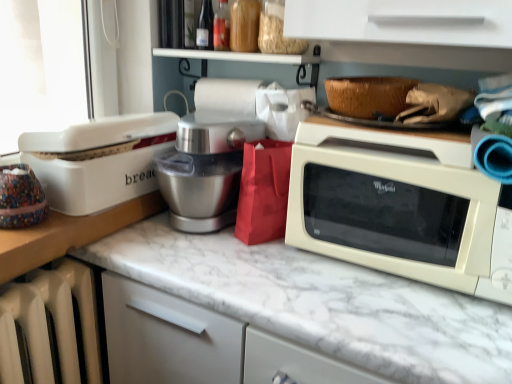
Question: Is white glossy microwave at right not within silver metallic mixer at center?

Choices:
 (A) no
 (B) yes

Answer: (B)

Question: Is white glossy microwave at right oriented towards silver metallic mixer at center?

Choices:
 (A) no
 (B) yes

Answer: (A)

Question: Is white glossy microwave at right oriented away from silver metallic mixer at center?

Choices:
 (A) no
 (B) yes

Answer: (A)

Question: From a real-world perspective, is white glossy microwave at right on silver metallic mixer at center?

Choices:
 (A) yes
 (B) no

Answer: (A)

Question: Does white glossy microwave at right appear on the right side of silver metallic mixer at center?

Choices:
 (A) no
 (B) yes

Answer: (B)

Question: Can you confirm if white glossy microwave at right is thinner than silver metallic mixer at center?

Choices:
 (A) yes
 (B) no

Answer: (B)

Question: From the image's perspective, is white glossy microwave at right located above white marble countertop at center?

Choices:
 (A) no
 (B) yes

Answer: (B)

Question: Is white glossy microwave at right at the left side of white marble countertop at center?

Choices:
 (A) yes
 (B) no

Answer: (B)

Question: Considering the relative sizes of white glossy microwave at right and white marble countertop at center in the image provided, is white glossy microwave at right thinner than white marble countertop at center?

Choices:
 (A) yes
 (B) no

Answer: (A)

Question: Is white glossy microwave at right located outside white marble countertop at center?

Choices:
 (A) yes
 (B) no

Answer: (A)

Question: Is white glossy microwave at right bigger than white marble countertop at center?

Choices:
 (A) yes
 (B) no

Answer: (B)

Question: Considering the relative sizes of white glossy microwave at right and white marble countertop at center in the image provided, is white glossy microwave at right smaller than white marble countertop at center?

Choices:
 (A) yes
 (B) no

Answer: (A)

Question: Can you confirm if white marble countertop at center is thinner than woven brown basket at upper right?

Choices:
 (A) yes
 (B) no

Answer: (B)